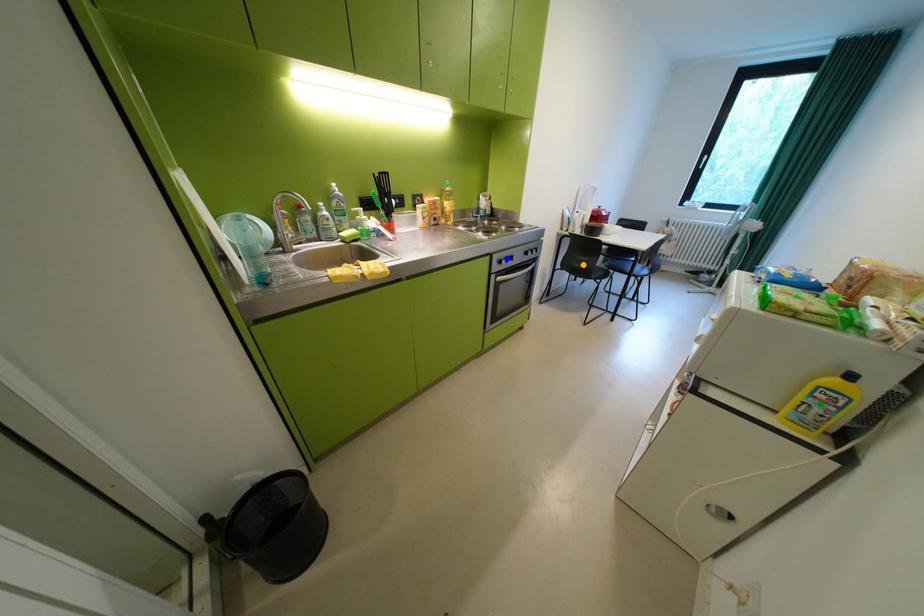
Order these from farthest to nearest:
1. orange point
2. blue point
3. green point

1. orange point
2. blue point
3. green point